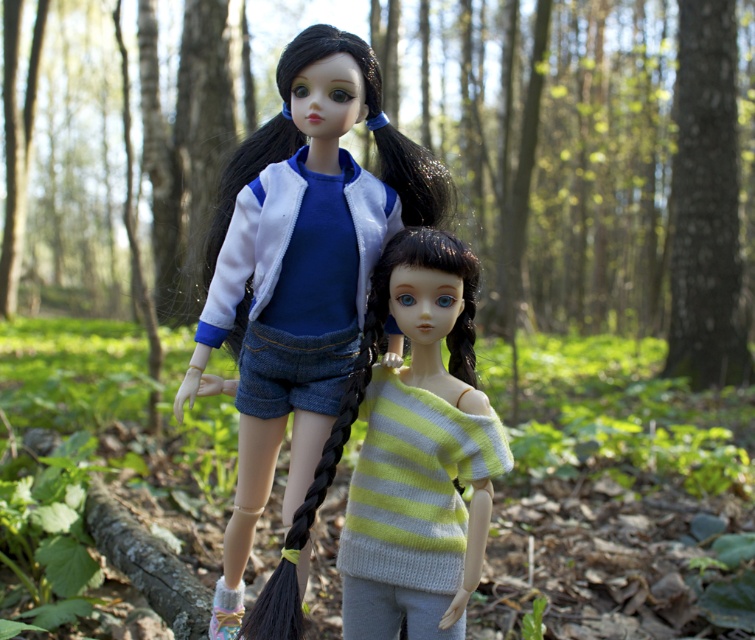
Question: Is the position of green leafy forest at center more distant than that of matte white jacket at center?

Choices:
 (A) no
 (B) yes

Answer: (B)

Question: Is green leafy forest at center to the left of knitted yellow-green sweater at center from the viewer's perspective?

Choices:
 (A) yes
 (B) no

Answer: (A)

Question: Based on their relative distances, which object is farther from the matte white jacket at center?

Choices:
 (A) knitted yellow-green sweater at center
 (B) green leafy forest at center

Answer: (B)

Question: Which is farther from the matte white jacket at center?

Choices:
 (A) green leafy forest at center
 (B) knitted yellow-green sweater at center

Answer: (A)

Question: Does green leafy forest at center have a smaller size compared to matte white jacket at center?

Choices:
 (A) no
 (B) yes

Answer: (A)

Question: Estimate the real-world distances between objects in this image. Which object is closer to the matte white jacket at center?

Choices:
 (A) green leafy forest at center
 (B) knitted yellow-green sweater at center

Answer: (B)